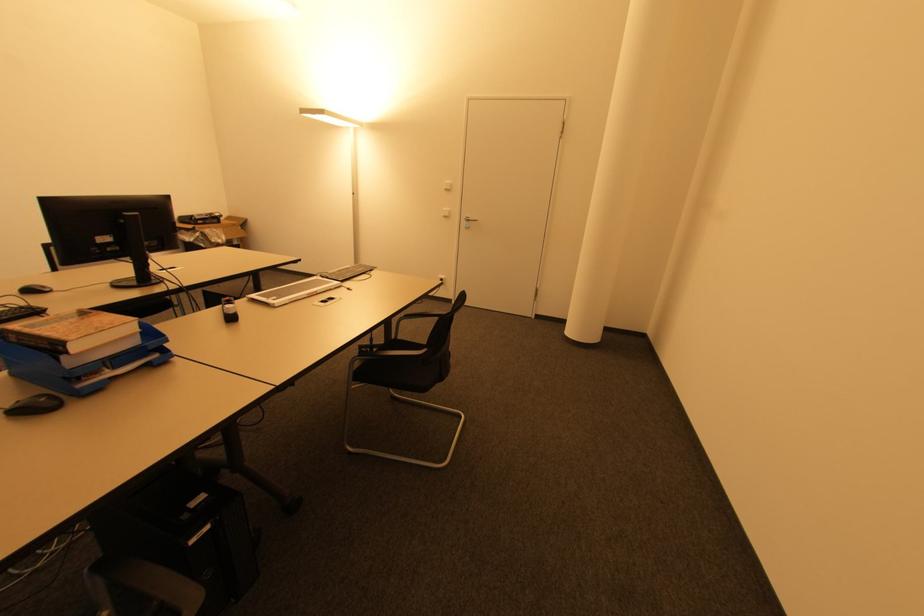
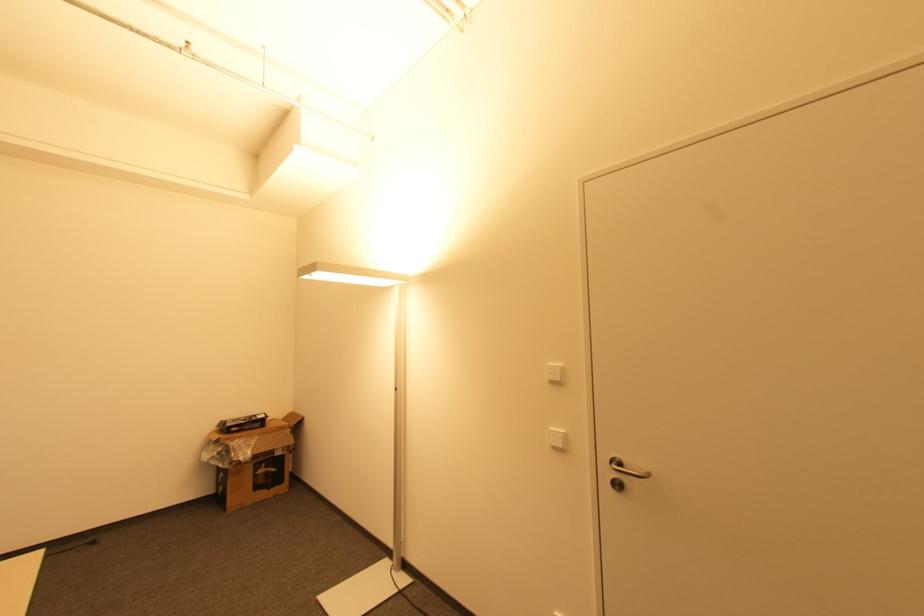
Find the pixel in the second image that matches [448,190] in the first image.

(554, 383)